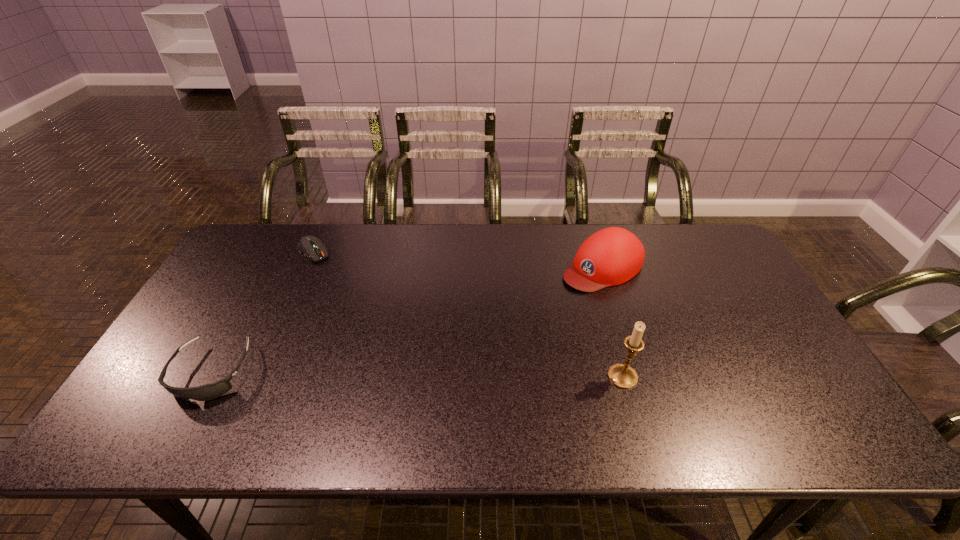
In order to click on vacant space on the desktop that is between the second shortest object and the candle holder and is positioned on the front-facing side of the third shortest object in this screenshot , I will do `click(432, 375)`.

The width and height of the screenshot is (960, 540). Find the location of `vacant space on the desktop that is between the second shortest object and the candle holder and is positioned on the button of the computer equipment`. vacant space on the desktop that is between the second shortest object and the candle holder and is positioned on the button of the computer equipment is located at coordinates (426, 375).